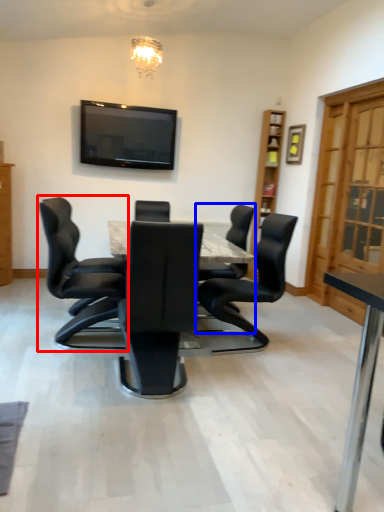
Question: Which object is further to the camera taking this photo, chair (highlighted by a red box) or chair (highlighted by a blue box)?

Choices:
 (A) chair
 (B) chair

Answer: (B)